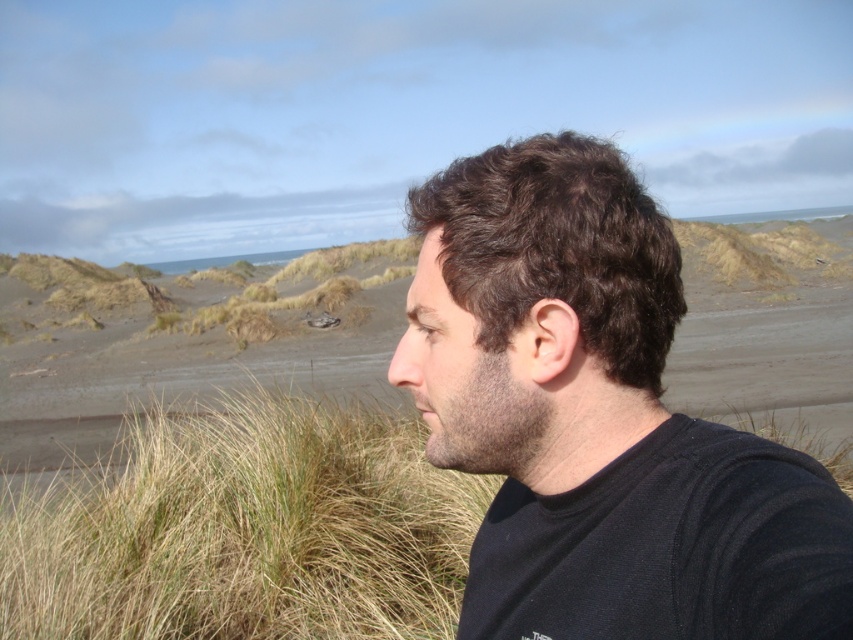
Does black matte shirt at center have a greater height compared to grassy textured grass at center?

Yes.

Measure the distance between black matte shirt at center and grassy textured grass at center.

black matte shirt at center is 3.40 meters from grassy textured grass at center.

Locate an element on the screen. black matte shirt at center is located at coordinates (598, 419).

Where is `black matte shirt at center`? The image size is (853, 640). black matte shirt at center is located at coordinates (598, 419).